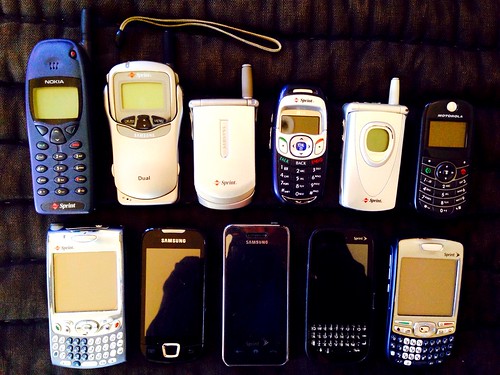
Locate an element on the screen. screen is located at coordinates (54, 103), (154, 89), (304, 127), (379, 139), (444, 135), (82, 287), (180, 302), (265, 297), (342, 266), (419, 295).